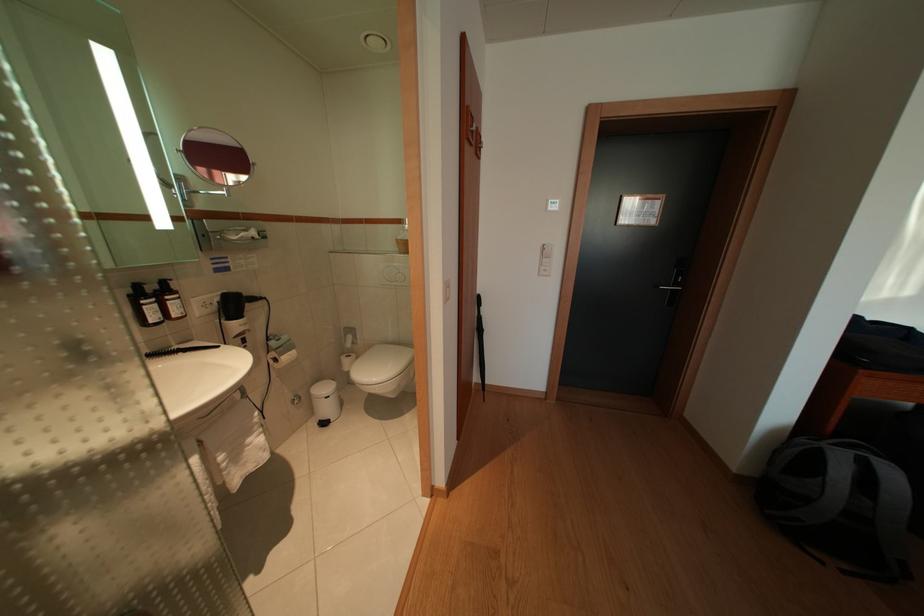
Where would you push the light switch button? Please return your answer as a coordinate pair (x, y).

(553, 205)